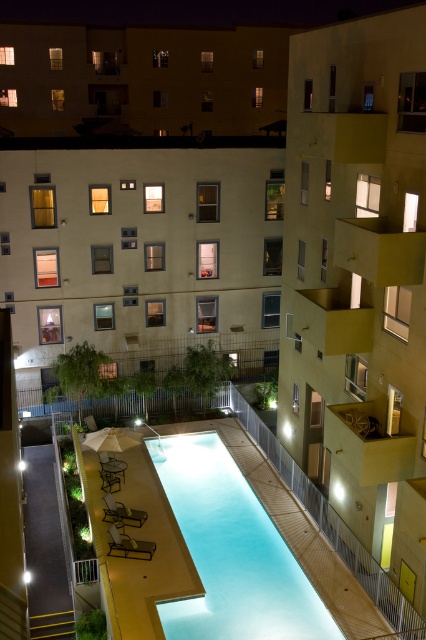
You are standing in the courtyard of the beige concrete building at center and want to reach the yellow concrete balcony at upper right. Which direction should you move towards?

You should move towards the right side of the beige concrete building at center to reach the yellow concrete balcony at upper right, as it is positioned on the right side of the building.

You are standing at the entrance of the residential building and want to take a photo of the smooth concrete pool at center without the yellow concrete balcony at upper right blocking the view. Is this possible?

The yellow concrete balcony at upper right is in front of the smooth concrete pool at center, so taking a photo from the current position would result in the balcony blocking the view of the pool. To capture the pool without obstruction, you need to reposition yourself to a vantage point where the balcony is not between you and the pool.

You are standing in front of the residential building and want to locate two points marked in the image. Which of the two points, point (406,241) or point (265,552), is closer to you?

Point (406,241) is closer to the viewer than point (265,552).